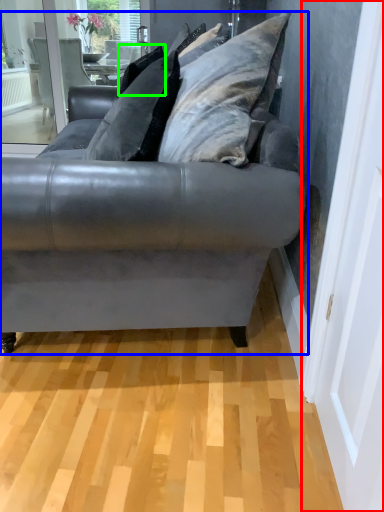
Question: Which object is the closest to the screen door (highlighted by a red box)? Choose among these: studio couch (highlighted by a blue box) or pillow (highlighted by a green box).

Choices:
 (A) studio couch
 (B) pillow

Answer: (A)